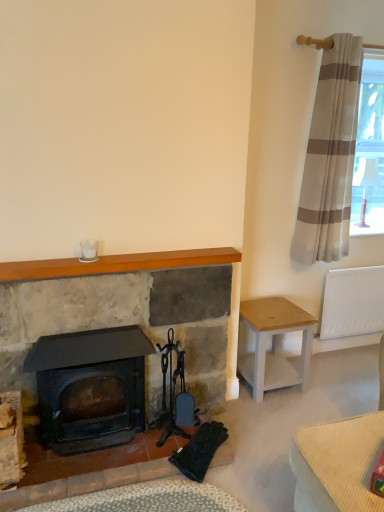
Question: Does white wood stool at right have a greater height compared to white fabric lampshade at upper right?

Choices:
 (A) no
 (B) yes

Answer: (A)

Question: Does white wood stool at right lie in front of white fabric lampshade at upper right?

Choices:
 (A) no
 (B) yes

Answer: (B)

Question: Does white wood stool at right appear on the right side of white fabric lampshade at upper right?

Choices:
 (A) no
 (B) yes

Answer: (A)

Question: From the image's perspective, is white wood stool at right on white fabric lampshade at upper right?

Choices:
 (A) no
 (B) yes

Answer: (A)

Question: Is white wood stool at right shorter than white fabric lampshade at upper right?

Choices:
 (A) no
 (B) yes

Answer: (B)

Question: Could you tell me if white wood stool at right is facing white fabric lampshade at upper right?

Choices:
 (A) yes
 (B) no

Answer: (B)

Question: From the image's perspective, is white glass at upper center beneath matte stone fireplace at center?

Choices:
 (A) no
 (B) yes

Answer: (A)

Question: Does white glass at upper center have a smaller size compared to matte stone fireplace at center?

Choices:
 (A) no
 (B) yes

Answer: (B)

Question: Is white glass at upper center at the left side of matte stone fireplace at center?

Choices:
 (A) yes
 (B) no

Answer: (A)

Question: Considering the relative sizes of white glass at upper center and matte stone fireplace at center in the image provided, is white glass at upper center taller than matte stone fireplace at center?

Choices:
 (A) no
 (B) yes

Answer: (A)

Question: Is white glass at upper center turned away from matte stone fireplace at center?

Choices:
 (A) yes
 (B) no

Answer: (B)

Question: Does white glass at upper center have a larger size compared to matte stone fireplace at center?

Choices:
 (A) no
 (B) yes

Answer: (A)

Question: Can you confirm if white fabric lampshade at upper right is shorter than wooden mantle at upper center?

Choices:
 (A) yes
 (B) no

Answer: (B)